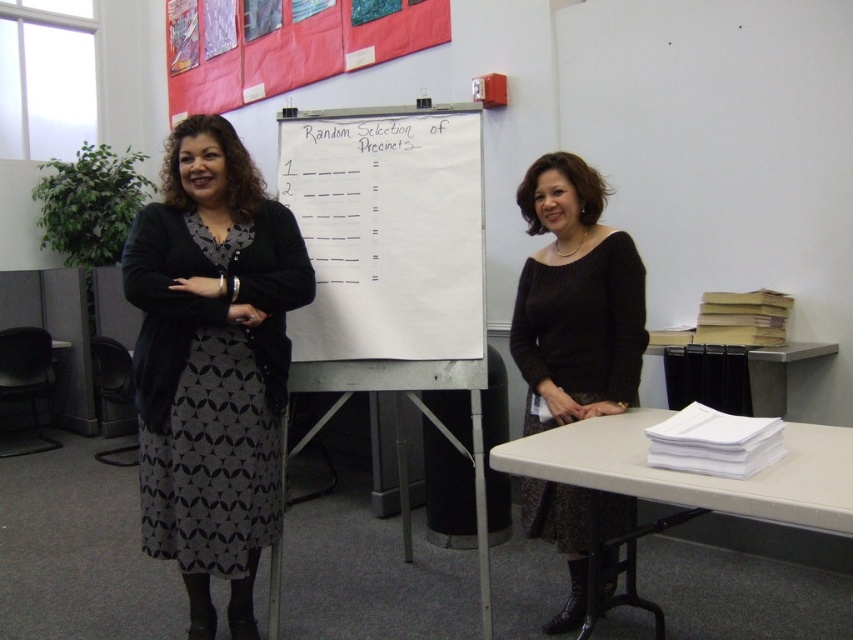
Who is higher up, patterned fabric skirt at left or white plastic table at lower right?

patterned fabric skirt at left is higher up.

Is patterned fabric skirt at left taller than white plastic table at lower right?

Yes, patterned fabric skirt at left is taller than white plastic table at lower right.

The width and height of the screenshot is (853, 640). I want to click on patterned fabric skirt at left, so click(212, 364).

Image resolution: width=853 pixels, height=640 pixels. In order to click on patterned fabric skirt at left in this screenshot , I will do `click(212, 364)`.

Is patterned fabric skirt at left below black knit sweater at center?

Incorrect, patterned fabric skirt at left is not positioned below black knit sweater at center.

Is point (138, 296) less distant than point (606, 396)?

Yes, it is.

This screenshot has height=640, width=853. What do you see at coordinates (212, 364) in the screenshot?
I see `patterned fabric skirt at left` at bounding box center [212, 364].

Identify the location of patterned fabric skirt at left. Image resolution: width=853 pixels, height=640 pixels. (212, 364).

Does patterned fabric skirt at left have a greater width compared to white paper at right?

Correct, the width of patterned fabric skirt at left exceeds that of white paper at right.

Is point (180, 486) behind point (749, 356)?

No, it is in front of (749, 356).

Which is in front, point (160, 400) or point (758, 400)?

Point (160, 400)

Where is `patterned fabric skirt at left`? The image size is (853, 640). patterned fabric skirt at left is located at coordinates (212, 364).